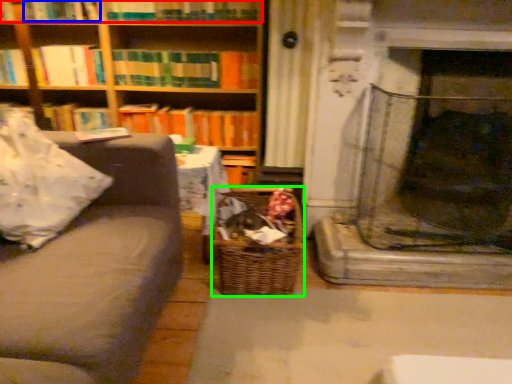
Question: Which object is the closest to the book (highlighted by a red box)? Choose among these: book (highlighted by a blue box) or basket (highlighted by a green box).

Choices:
 (A) book
 (B) basket

Answer: (A)